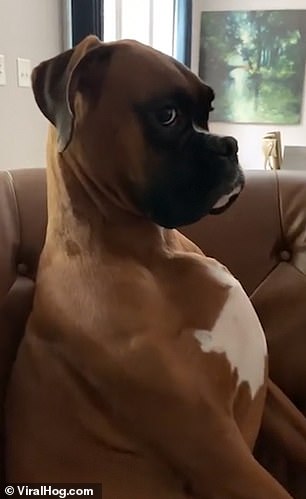
At what (x,y) coordinates should I click in order to perform the action: click on couch. Please return your answer as a coordinate pair (x, y). This screenshot has width=306, height=499. Looking at the image, I should click on (259, 240).